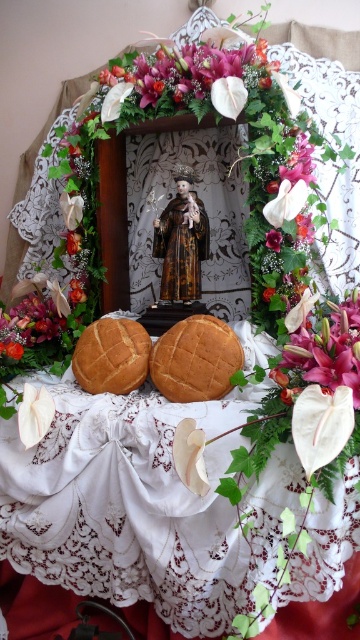
Question: Is pink silk flower at upper right bigger than golden brown crusty bread at center?

Choices:
 (A) yes
 (B) no

Answer: (A)

Question: Which object is the closest to the golden brown crusty bread at center?

Choices:
 (A) purple glossy flower at center
 (B) golden brown crumbly bread at center

Answer: (B)

Question: Which object is closer to the camera taking this photo?

Choices:
 (A) pink silk flower at upper right
 (B) golden brown crusty bread at center
 (C) golden brown crumbly bread at center

Answer: (A)

Question: Is pink silk flower at upper right below purple glossy flower at center?

Choices:
 (A) yes
 (B) no

Answer: (A)

Question: Which is nearer to the purple glossy flower at center?

Choices:
 (A) golden brown crumbly bread at center
 (B) pink silk flower at upper right

Answer: (A)

Question: Can you confirm if golden brown crusty bread at center is smaller than purple glossy flower at center?

Choices:
 (A) yes
 (B) no

Answer: (B)